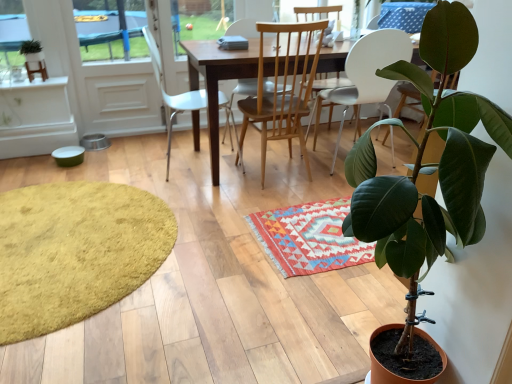
Locate an element on the screen. free space in front of light wood/wooden chair at center, which is counted as the 2th chair, starting from the right is located at coordinates (254, 196).